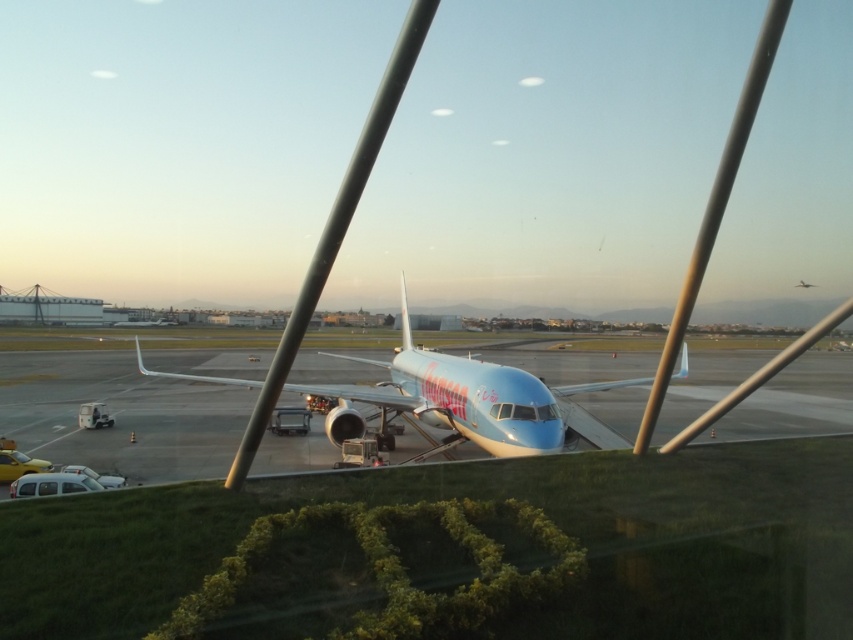
Which of these two, light blue metallic airplane at center or metallic silver airplane at center, stands taller?

Standing taller between the two is light blue metallic airplane at center.

Who is positioned more to the right, light blue metallic airplane at center or metallic silver airplane at center?

From the viewer's perspective, metallic silver airplane at center appears more on the right side.

Is point (524, 408) farther from viewer compared to point (799, 280)?

No, (524, 408) is in front of (799, 280).

At what (x,y) coordinates should I click in order to perform the action: click on light blue metallic airplane at center. Please return your answer as a coordinate pair (x, y). Looking at the image, I should click on (468, 401).